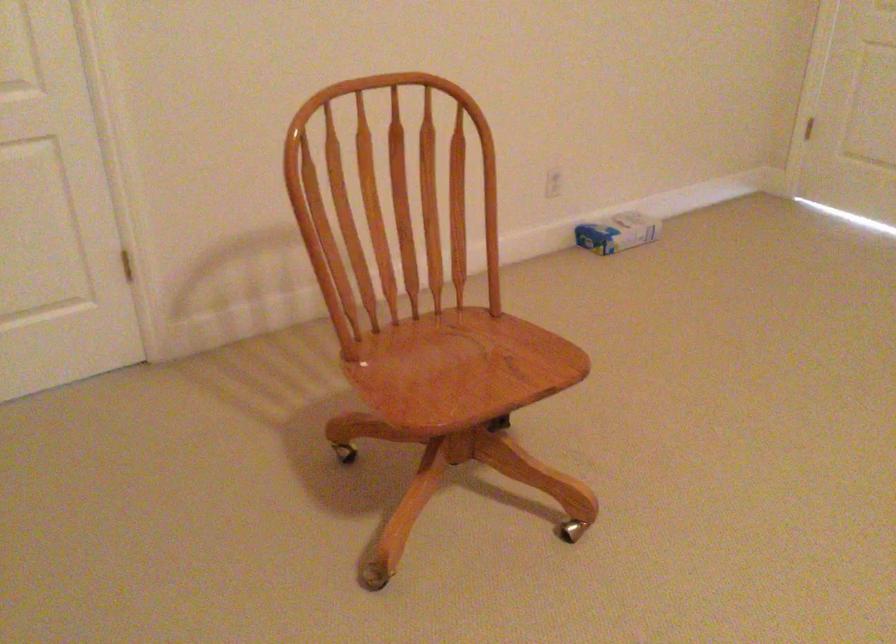
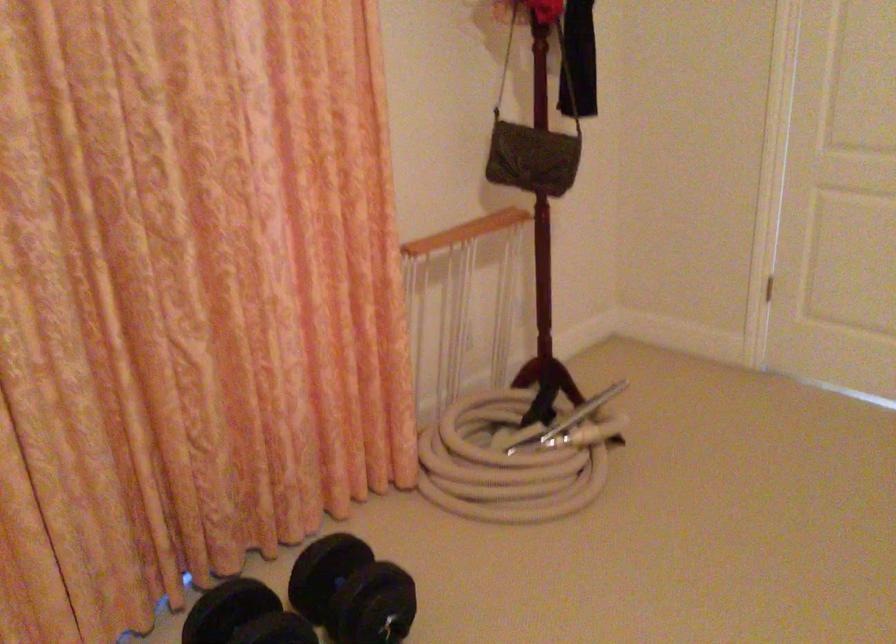
Question: The first image is from the beginning of the video and the second image is from the end. How did the camera likely rotate when shooting the video?

Choices:
 (A) Left
 (B) Right
 (C) Up
 (D) Down

Answer: (A)